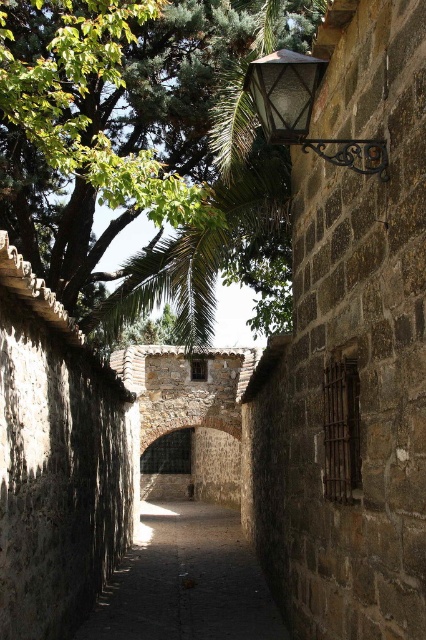
Is green leafy tree at upper left to the right of matte glass lamp at upper right from the viewer's perspective?

Incorrect, green leafy tree at upper left is not on the right side of matte glass lamp at upper right.

Which is more to the right, green leafy tree at upper left or matte glass lamp at upper right?

matte glass lamp at upper right is more to the right.

This screenshot has height=640, width=426. Describe the element at coordinates (120, 116) in the screenshot. I see `green leafy tree at upper left` at that location.

The height and width of the screenshot is (640, 426). Find the location of `green leafy tree at upper left`. green leafy tree at upper left is located at coordinates (120, 116).

Is green leafy tree at upper left below dark stone path at center?

Actually, green leafy tree at upper left is above dark stone path at center.

Does green leafy tree at upper left come behind dark stone path at center?

No, green leafy tree at upper left is in front of dark stone path at center.

Does point (308, 3) come farther from viewer compared to point (212, 538)?

No, (308, 3) is closer to viewer.

Find the location of a particular element. The height and width of the screenshot is (640, 426). green leafy tree at upper left is located at coordinates 120,116.

Between dark stone path at center and matte glass lamp at upper right, which one has more height?

Standing taller between the two is dark stone path at center.

Is point (89, 620) more distant than point (376, 150)?

Yes, it is behind point (376, 150).

The width and height of the screenshot is (426, 640). What do you see at coordinates (187, 580) in the screenshot?
I see `dark stone path at center` at bounding box center [187, 580].

Locate an element on the screen. dark stone path at center is located at coordinates (187, 580).